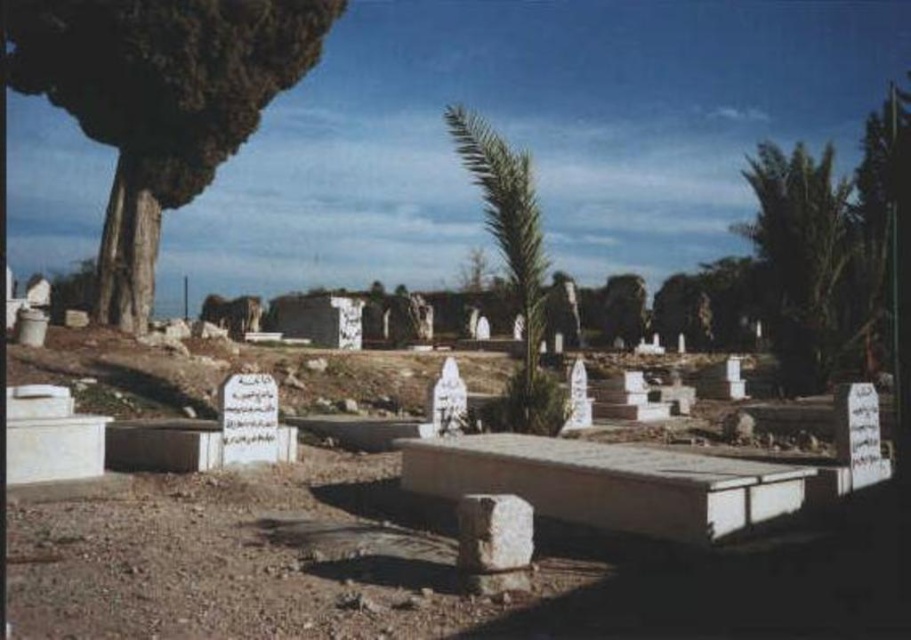
Question: Does green leafy tree at left have a smaller size compared to white stone gravestone at center?

Choices:
 (A) yes
 (B) no

Answer: (B)

Question: Can you confirm if brown dirt field at center is smaller than green leafy palm at center?

Choices:
 (A) yes
 (B) no

Answer: (A)

Question: Estimate the real-world distances between objects in this image. Which object is farther from the brown dirt field at center?

Choices:
 (A) green leafy palm tree at upper right
 (B) green leafy tree at left
 (C) green leafy palm at center
 (D) white stone gravestone at center

Answer: (A)

Question: Considering the relative positions of green leafy palm at center and white stone gravestone at center in the image provided, where is green leafy palm at center located with respect to white stone gravestone at center?

Choices:
 (A) above
 (B) below

Answer: (A)

Question: Which point is farther to the camera?

Choices:
 (A) brown dirt field at center
 (B) white stone gravestone at center
 (C) green leafy tree at left
 (D) green leafy palm at center

Answer: (C)

Question: Which of the following is the closest to the observer?

Choices:
 (A) green leafy palm at center
 (B) green leafy palm tree at upper right

Answer: (A)